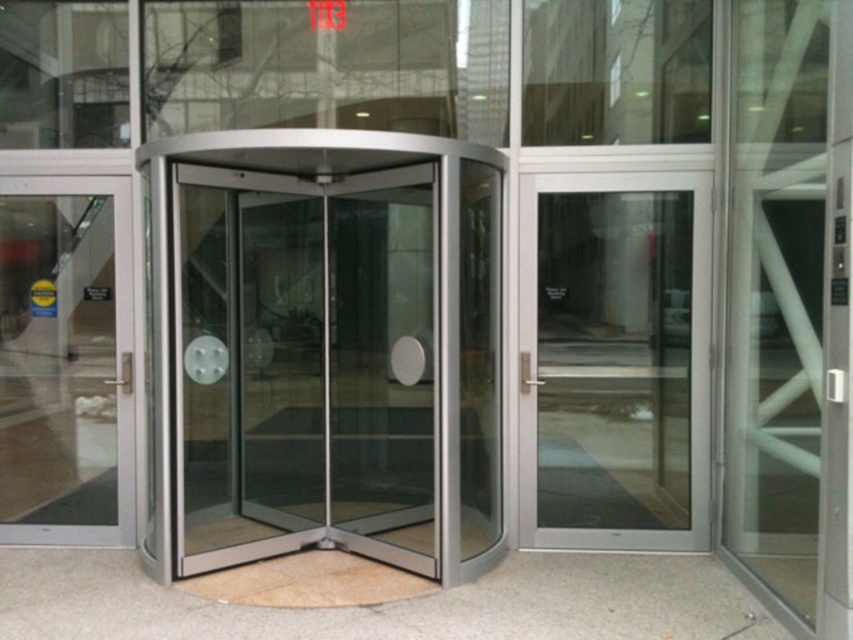
You are standing in front of the revolving door and want to exit the building. You notice two additional doors nearby. Which door should you approach first if you want to exit quickly, the clear glass door at right or the transparent glass door at left?

The clear glass door at right is closer to the viewer than the transparent glass door at left, so you should approach the clear glass door at right first to exit quickly.

You are a delivery person trying to enter the building with a large box that is 2 meters tall. You notice two glass doors, the clear glass door at right and the transparent glass door at left. Which door should you choose to ensure your box fits through the entrance without hitting the top?

The clear glass door at right has a greater height compared to the transparent glass door at left, so you should choose the clear glass door at right to ensure your box fits through the entrance without hitting the top.